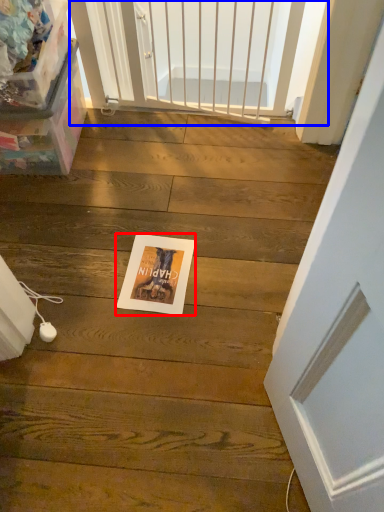
Question: Which of the following is the farthest to the observer, postcard (highlighted by a red box) or screen door (highlighted by a blue box)?

Choices:
 (A) postcard
 (B) screen door

Answer: (B)